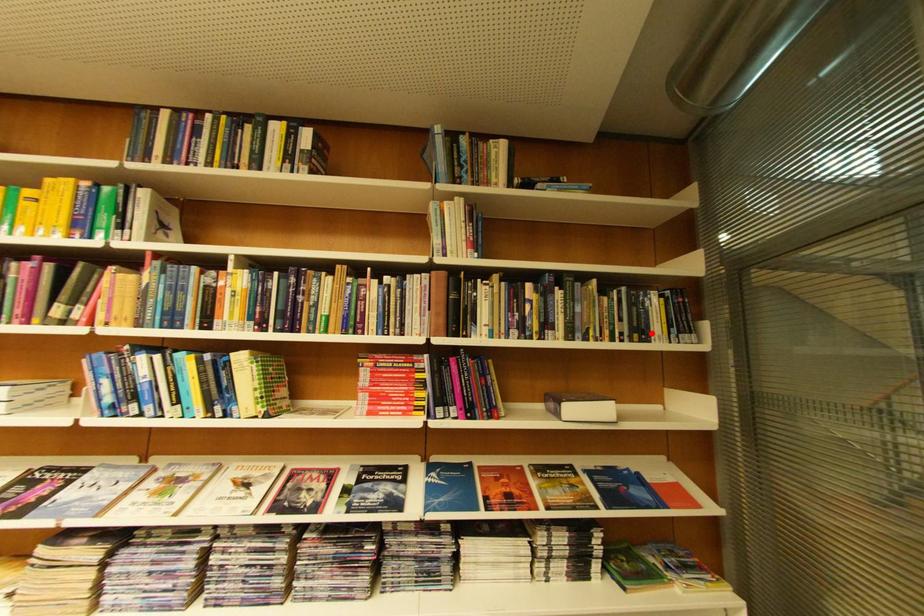
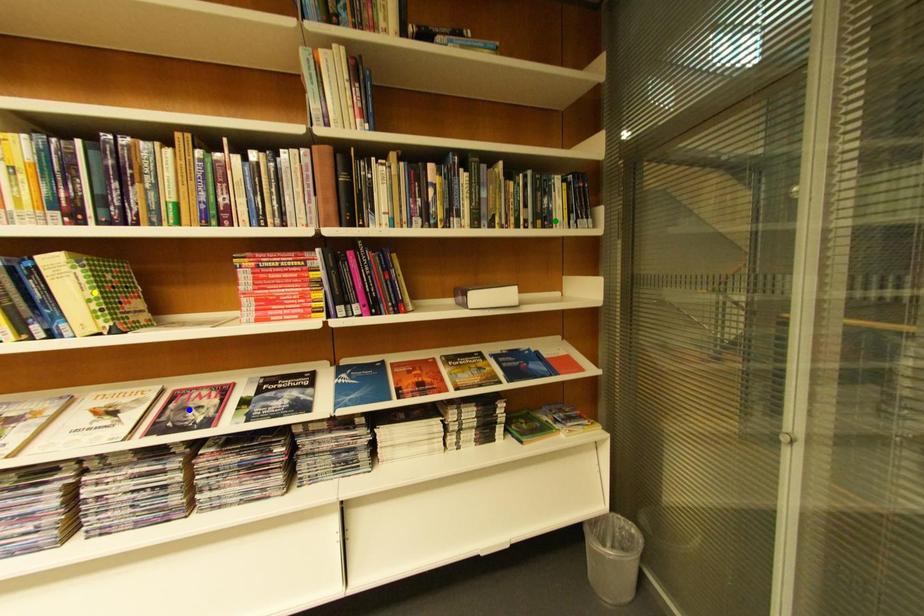
Question: I am providing you with two images of the same scene from different viewpoints. A red point is marked on the first image. You are given multiple points on the second image. Which spot in image 2 lines up with the point in image 1?

Choices:
 (A) yellow point
 (B) blue point
 (C) green point

Answer: (C)